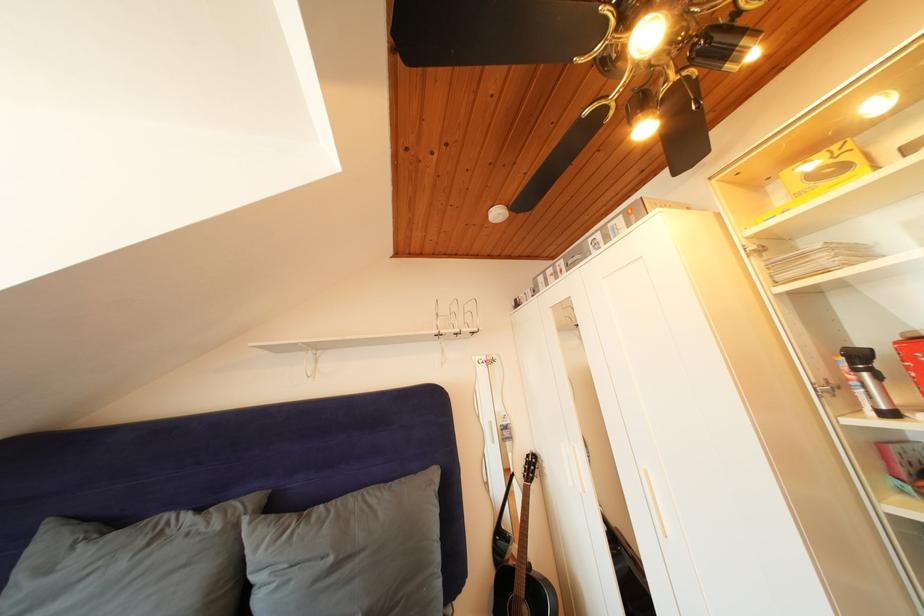
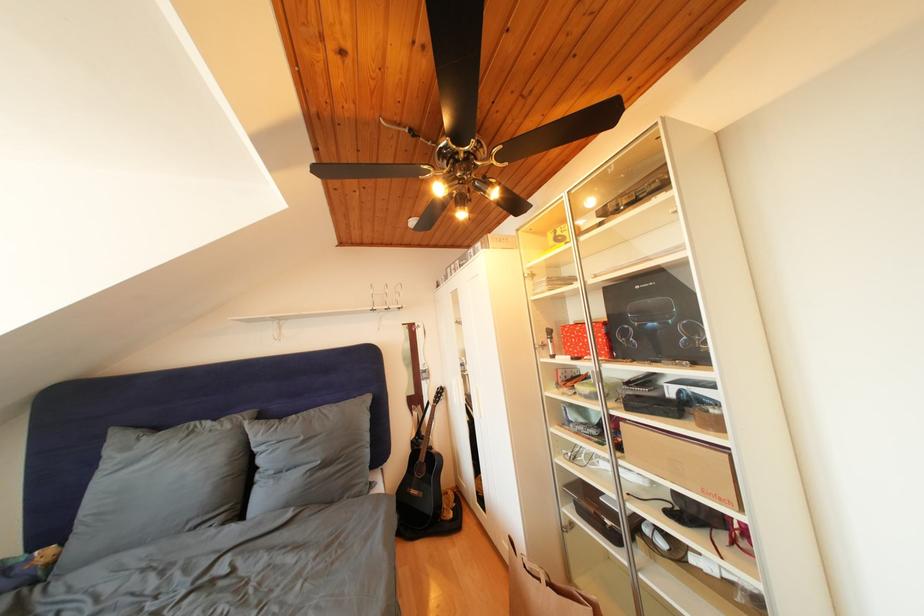
Locate, in the second image, the point that corresponds to (x=338, y=565) in the first image.

(310, 444)